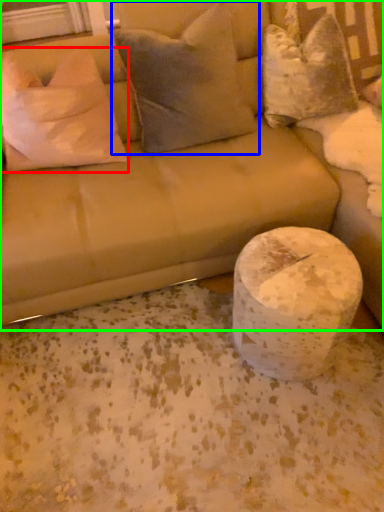
Question: Which object is positioned closest to pillow (highlighted by a red box)? Select from pillow (highlighted by a blue box) and studio couch (highlighted by a green box).

Choices:
 (A) pillow
 (B) studio couch

Answer: (B)